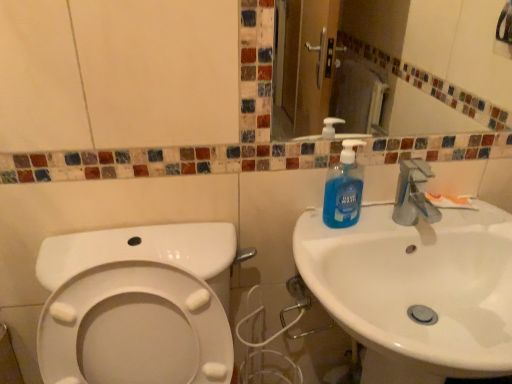
This screenshot has height=384, width=512. I want to click on white matte toothpaste at sink right, so click(x=450, y=201).

From the picture: How different are the orientations of blue liquid soap at sink right and white glossy sink at right in degrees?

4.24 degrees.

The width and height of the screenshot is (512, 384). In order to click on sink in front of the blue liquid soap at sink right in this screenshot , I will do `click(416, 291)`.

Looking at the image, does blue liquid soap at sink right seem bigger or smaller compared to white glossy sink at right?

Clearly, blue liquid soap at sink right is smaller in size than white glossy sink at right.

Is blue liquid soap at sink right with white glossy sink at right?

No, blue liquid soap at sink right is not next to white glossy sink at right.

Between blue liquid soap at sink right and white matte toothpaste at sink right, which one appears on the right side from the viewer's perspective?

From the viewer's perspective, white matte toothpaste at sink right appears more on the right side.

From the picture: Between blue liquid soap at sink right and white matte toothpaste at sink right, which one has smaller size?

Smaller between the two is white matte toothpaste at sink right.

Is blue liquid soap at sink right turned away from white matte toothpaste at sink right?

No, blue liquid soap at sink right is not facing the opposite direction of white matte toothpaste at sink right.

You are a GUI agent. You are given a task and a screenshot of the screen. Output one action in this format:
    pyautogui.click(x=<x>, y=<y>)
    Task: Click on the toothpaste located below the blue liquid soap at sink right (from the image's perspective)
    This screenshot has width=512, height=384.
    Given the screenshot: What is the action you would take?
    pyautogui.click(x=450, y=201)

From the picture: From a real-world perspective, which is physically above, white glossy sink at right or white matte toothpaste at sink right?

white matte toothpaste at sink right is physically above.

Does white glossy sink at right have a smaller size compared to white matte toothpaste at sink right?

No.

Consider the image. Is white glossy sink at right in front of or behind white matte toothpaste at sink right in the image?

white glossy sink at right is positioned closer to the viewer than white matte toothpaste at sink right.

Does white glossy sink at right appear on the right side of white matte toothpaste at sink right?

In fact, white glossy sink at right is to the left of white matte toothpaste at sink right.

Find the location of `toothpaste on the right of white glossy sink at right`. toothpaste on the right of white glossy sink at right is located at coordinates (450, 201).

Which of these two, white matte toothpaste at sink right or white glossy sink at right, is bigger?

Bigger between the two is white glossy sink at right.

From the image's perspective, relative to white glossy sink at right, is white matte toothpaste at sink right above or below?

white matte toothpaste at sink right is above white glossy sink at right.

Which of these two, white matte toothpaste at sink right or white glossy sink at right, stands taller?

white glossy sink at right.

From a real-world perspective, is white matte toothpaste at sink right positioned above or below blue liquid soap at sink right?

In terms of real-world spatial position, white matte toothpaste at sink right is below blue liquid soap at sink right.

Considering the positions of objects white matte toothpaste at sink right and blue liquid soap at sink right in the image provided, who is behind, white matte toothpaste at sink right or blue liquid soap at sink right?

white matte toothpaste at sink right is more distant.

Is white matte toothpaste at sink right smaller than blue liquid soap at sink right?

Yes, white matte toothpaste at sink right is smaller than blue liquid soap at sink right.

Is white matte toothpaste at sink right directly adjacent to blue liquid soap at sink right?

No.

Consider the image. Which object is wider, white glossy sink at right or blue liquid soap at sink right?

white glossy sink at right is wider.

Does white glossy sink at right contain blue liquid soap at sink right?

Yes, blue liquid soap at sink right is a part of white glossy sink at right.

Are white glossy sink at right and blue liquid soap at sink right far apart?

No, there isn't a large distance between white glossy sink at right and blue liquid soap at sink right.

Considering the relative positions of white glossy sink at right and blue liquid soap at sink right in the image provided, is white glossy sink at right to the left or to the right of blue liquid soap at sink right?

In the image, white glossy sink at right appears on the right side of blue liquid soap at sink right.

I want to click on sink on the right of the blue liquid soap at sink right, so click(416, 291).

At what (x,y) coordinates should I click in order to perform the action: click on toothpaste behind the blue liquid soap at sink right. Please return your answer as a coordinate pair (x, y). This screenshot has width=512, height=384. Looking at the image, I should click on (450, 201).

Based on their spatial positions, is white matte toothpaste at sink right or blue liquid soap at sink right closer to white glossy sink at right?

The object closer to white glossy sink at right is blue liquid soap at sink right.

Looking at the image, which one is located further to blue liquid soap at sink right, white glossy sink at right or white matte toothpaste at sink right?

Among the two, white matte toothpaste at sink right is located further to blue liquid soap at sink right.

When comparing their distances from white matte toothpaste at sink right, does blue liquid soap at sink right or white glossy sink at right seem closer?

blue liquid soap at sink right.

Looking at this image, from the image, which object appears to be nearer to white glossy sink at right, blue liquid soap at sink right or white matte toothpaste at sink right?

blue liquid soap at sink right lies closer to white glossy sink at right than the other object.

Based on their spatial positions, is white glossy sink at right or blue liquid soap at sink right further from white matte toothpaste at sink right?

white glossy sink at right is positioned further to the anchor white matte toothpaste at sink right.

From the image, which object appears to be farther from blue liquid soap at sink right, white matte toothpaste at sink right or white glossy sink at right?

white matte toothpaste at sink right is positioned further to the anchor blue liquid soap at sink right.

At what (x,y) coordinates should I click in order to perform the action: click on cleaning product positioned between white glossy sink at right and white matte toothpaste at sink right from near to far. Please return your answer as a coordinate pair (x, y). The height and width of the screenshot is (384, 512). Looking at the image, I should click on (344, 189).